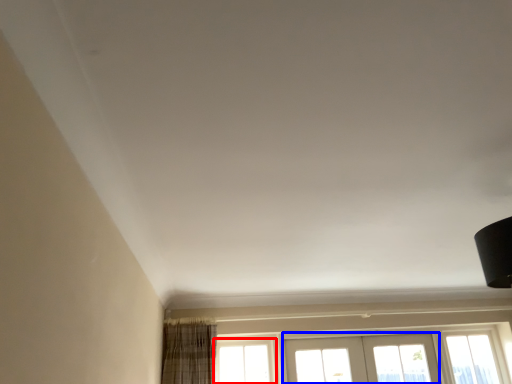
Question: Which object appears farthest to the camera in this image, window (highlighted by a red box) or screen door (highlighted by a blue box)?

Choices:
 (A) window
 (B) screen door

Answer: (B)